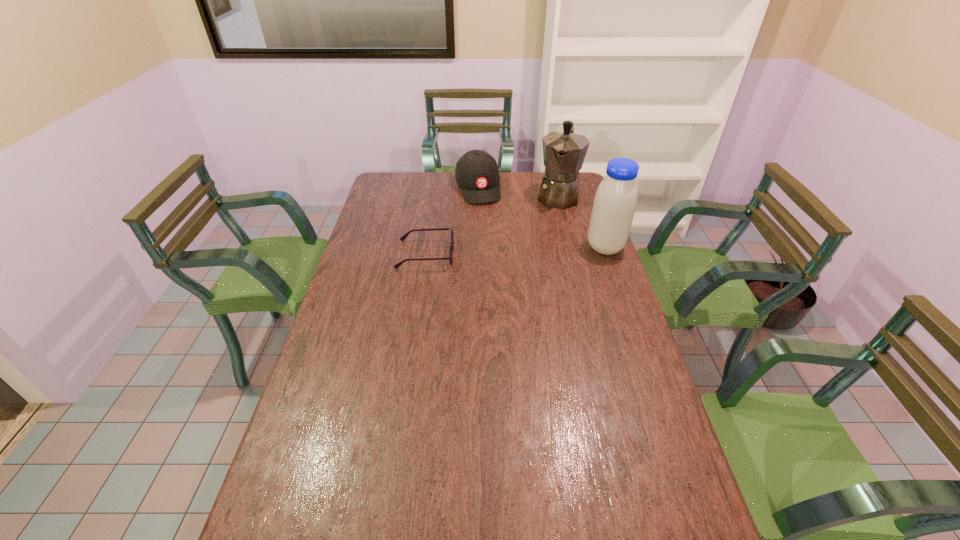
Identify the location of free space on the desktop that is between the shortest object and the soya milk and is positioned on the pouring side of the coffeepot. The image size is (960, 540). (542, 250).

Locate an element on the screen. vacant space on the desktop that is between the shortest object and the soya milk and is positioned with a logo on the front of the second shortest object is located at coordinates (501, 252).